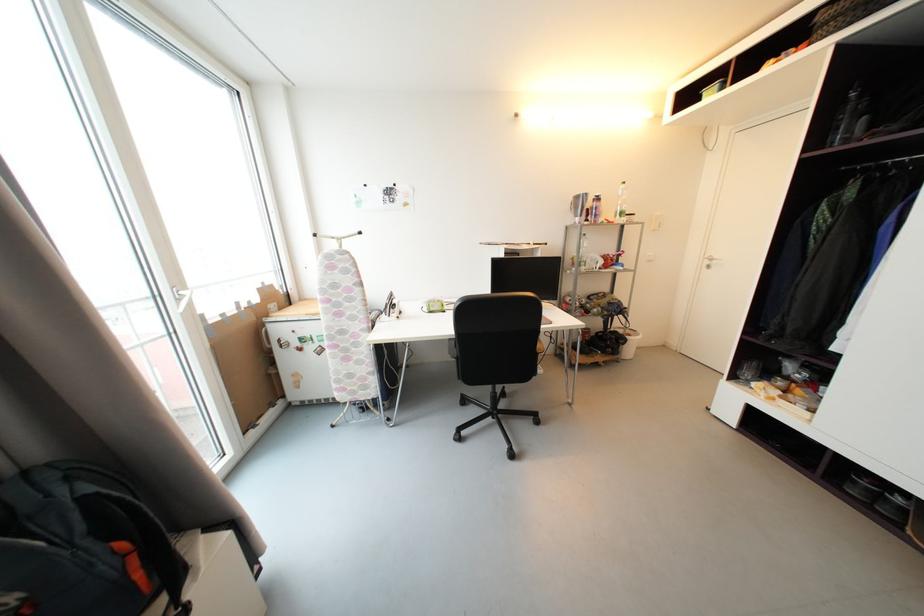
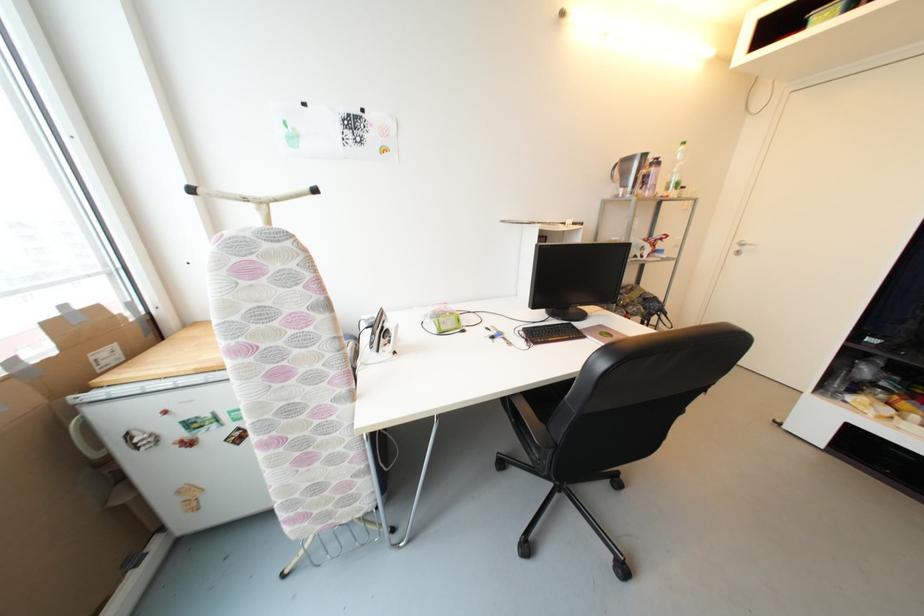
Find the pixel in the second image that matches the point at 711,264 in the first image.

(742, 249)